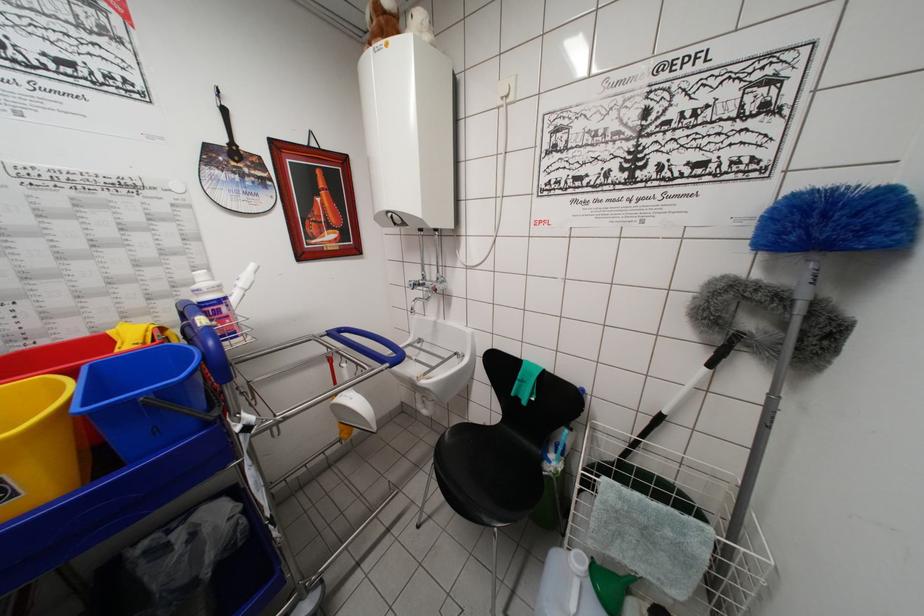
Describe the element at coordinates (488, 381) in the screenshot. This screenshot has height=616, width=924. I see `the blue rack handle` at that location.